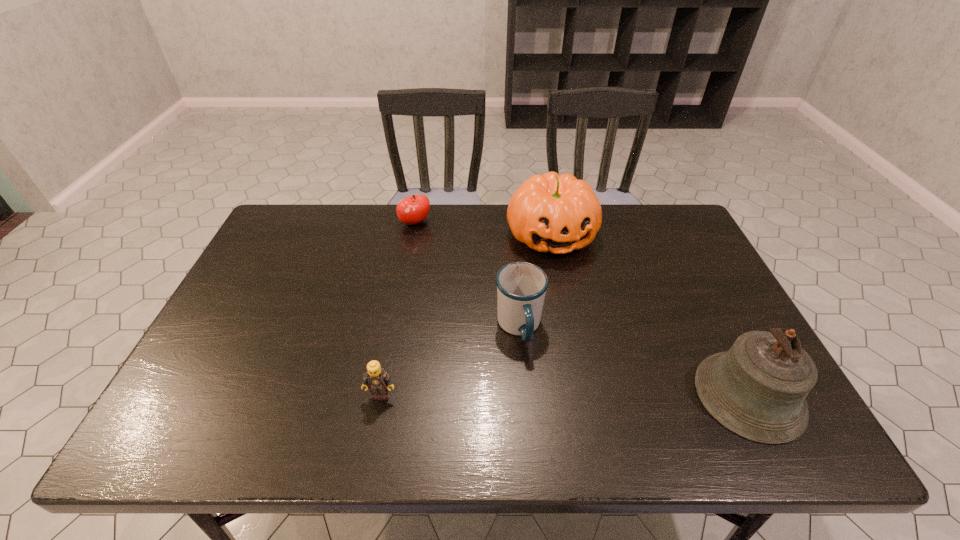
Locate an element on the screen. The image size is (960, 540). vacant point located between the Lego and the apple is located at coordinates (398, 309).

Identify which object is the fourth nearest to the rightmost object. Please provide its 2D coordinates. Your answer should be formatted as a tuple, i.e. [(x, y)], where the tuple contains the x and y coordinates of a point satisfying the conditions above.

[(411, 210)]

This screenshot has width=960, height=540. What are the coordinates of `the third closest object to the Lego` in the screenshot? It's located at (411, 210).

Locate an element on the screen. vacant position in the image that satisfies the following two spatial constraints: 1. in front of the Lego; 2. on the right side of the rightmost object is located at coordinates (381, 395).

You are a GUI agent. You are given a task and a screenshot of the screen. Output one action in this format:
    pyautogui.click(x=<x>, y=<y>)
    Task: Click on the free space that satisfies the following two spatial constraints: 1. on the front side of the mug; 2. on the left side of the apple
    Image resolution: width=960 pixels, height=540 pixels.
    Given the screenshot: What is the action you would take?
    pyautogui.click(x=396, y=327)